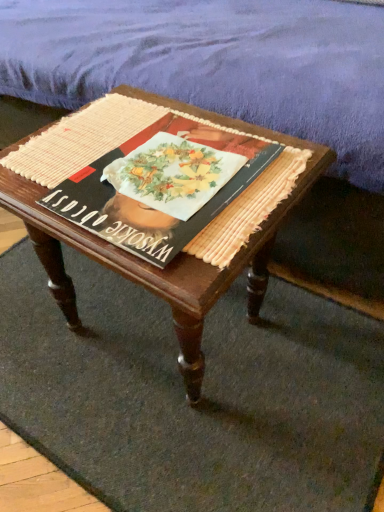
Question: Does point (6, 415) appear closer or farther from the camera than point (97, 35)?

Choices:
 (A) closer
 (B) farther

Answer: (A)

Question: Looking at their shapes, would you say woven beige doormat at center is wider or thinner than purple fabric mattress at upper center?

Choices:
 (A) thin
 (B) wide

Answer: (A)

Question: Which is nearer to the matte black book at center?

Choices:
 (A) wooden coffee table at center
 (B) purple fabric mattress at upper center
 (C) woven beige doormat at center

Answer: (A)

Question: Which object is positioned closest to the woven beige doormat at center?

Choices:
 (A) purple fabric mattress at upper center
 (B) wooden coffee table at center
 (C) matte black book at center

Answer: (B)